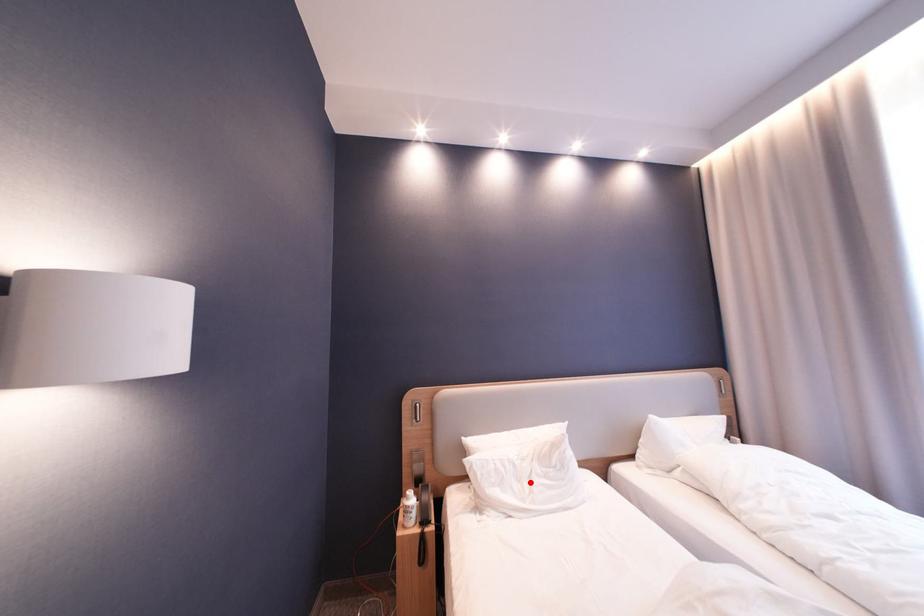
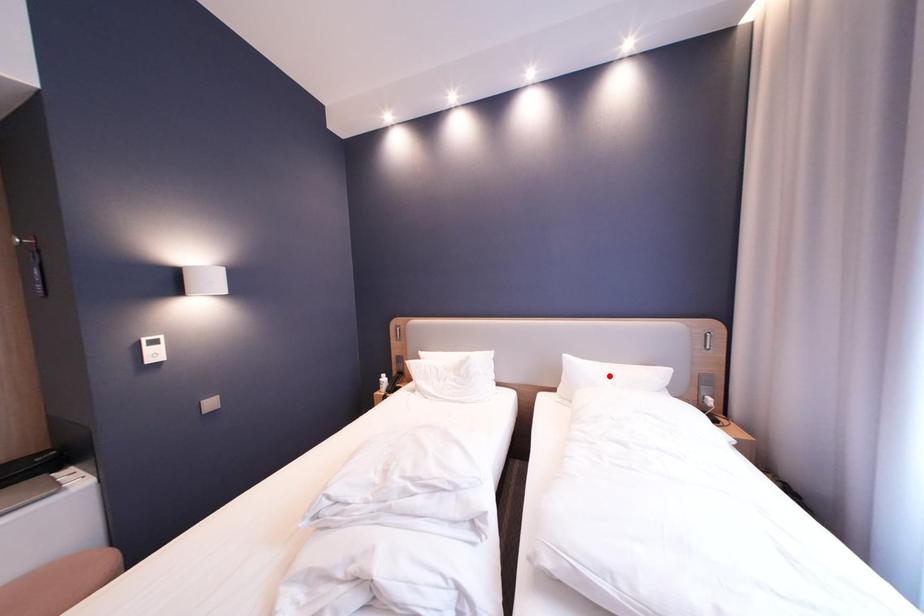
I am providing you with two images of the same scene from different viewpoints. A red point is marked on the first image and another point is marked on the second image. Are the points marked in image1 and image2 representing the same 3D position?

No